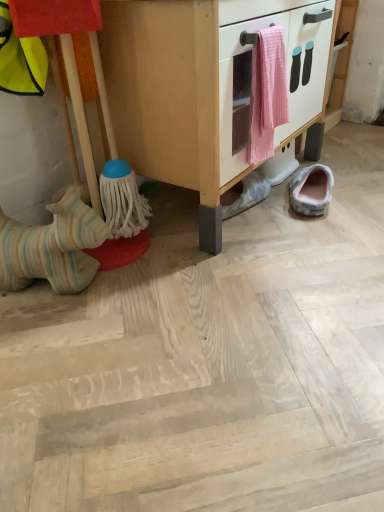
Question: Can you confirm if light pink fabric slipper at lower right, the first footwear positioned from the right, is smaller than striped fabric horse at left?

Choices:
 (A) yes
 (B) no

Answer: (A)

Question: Does light pink fabric slipper at lower right, positioned as the 3th footwear in left-to-right order, have a lesser width compared to striped fabric horse at left?

Choices:
 (A) yes
 (B) no

Answer: (A)

Question: Is light pink fabric slipper at lower right, positioned as the 3th footwear in left-to-right order, closer to the viewer compared to striped fabric horse at left?

Choices:
 (A) yes
 (B) no

Answer: (B)

Question: Would you say light pink fabric slipper at lower right, the first footwear positioned from the right, contains striped fabric horse at left?

Choices:
 (A) no
 (B) yes

Answer: (A)

Question: Does light pink fabric slipper at lower right, positioned as the 3th footwear in left-to-right order, turn towards striped fabric horse at left?

Choices:
 (A) no
 (B) yes

Answer: (A)

Question: Is light pink fabric slipper at lower right, positioned as the 3th footwear in left-to-right order, in front of or behind striped fabric horse at left in the image?

Choices:
 (A) front
 (B) behind

Answer: (B)

Question: Considering the positions of point (319, 188) and point (62, 10), is point (319, 188) closer or farther from the camera than point (62, 10)?

Choices:
 (A) farther
 (B) closer

Answer: (A)

Question: Which is correct: light pink fabric slipper at lower right, the first footwear positioned from the right, is inside striped fabric horse at left, or outside of it?

Choices:
 (A) outside
 (B) inside

Answer: (A)

Question: Looking at the image, does light pink fabric slipper at lower right, positioned as the 3th footwear in left-to-right order, seem bigger or smaller compared to striped fabric horse at left?

Choices:
 (A) small
 (B) big

Answer: (A)

Question: From the image's perspective, is white fabric slipper at lower center, the second footwear when ordered from right to left, positioned above or below pink woven towel at center?

Choices:
 (A) below
 (B) above

Answer: (A)

Question: In terms of width, does white fabric slipper at lower center, the 2th footwear positioned from the left, look wider or thinner when compared to pink woven towel at center?

Choices:
 (A) thin
 (B) wide

Answer: (B)

Question: Considering the positions of point (243, 183) and point (251, 111), is point (243, 183) closer or farther from the camera than point (251, 111)?

Choices:
 (A) closer
 (B) farther

Answer: (B)

Question: Is white fabric slipper at lower center, the second footwear when ordered from right to left, inside the boundaries of pink woven towel at center, or outside?

Choices:
 (A) inside
 (B) outside

Answer: (B)

Question: Relative to wooden cabinet at center, is pink woven towel at center in front or behind?

Choices:
 (A) behind
 (B) front

Answer: (A)

Question: In terms of height, does pink woven towel at center look taller or shorter compared to wooden cabinet at center?

Choices:
 (A) tall
 (B) short

Answer: (B)